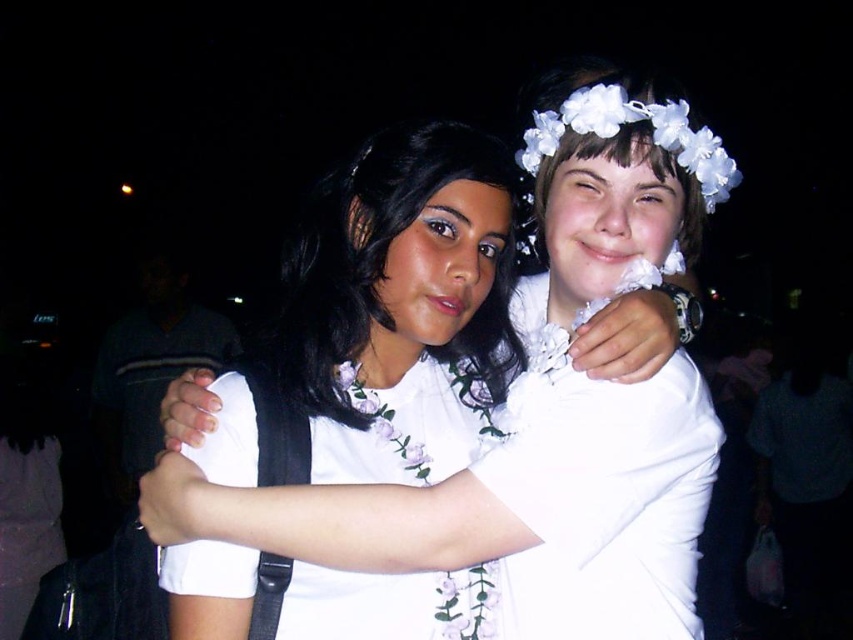
Question: Among these objects, which one is nearest to the camera?

Choices:
 (A) white floral fabric dress at center
 (B) white matte floral crown at upper center
 (C) white matte flower crown at upper center
 (D) white floral crown at upper right

Answer: (B)

Question: Does white matte flower crown at upper center appear over white floral crown at upper right?

Choices:
 (A) no
 (B) yes

Answer: (A)

Question: Which object is the closest to the white matte floral crown at upper center?

Choices:
 (A) white floral fabric dress at center
 (B) white matte flower crown at upper center

Answer: (A)

Question: Which point is farther from the camera taking this photo?

Choices:
 (A) (223, 513)
 (B) (709, 145)
 (C) (416, 273)

Answer: (B)

Question: From the image, what is the correct spatial relationship of white matte flower crown at upper center in relation to white floral fabric dress at center?

Choices:
 (A) below
 (B) above

Answer: (B)

Question: Is white matte flower crown at upper center to the right of white floral crown at upper right from the viewer's perspective?

Choices:
 (A) no
 (B) yes

Answer: (A)